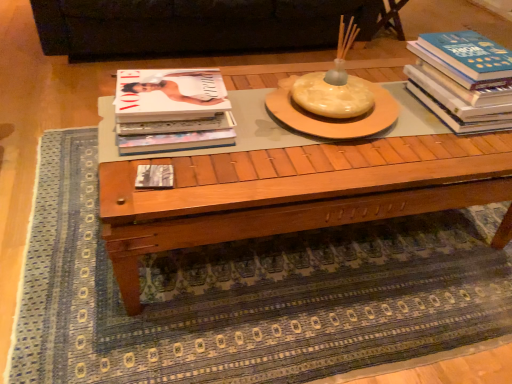
Locate an element on the screen. vacant area on top of wooden coffee table at center (from a real-world perspective) is located at coordinates (298, 131).